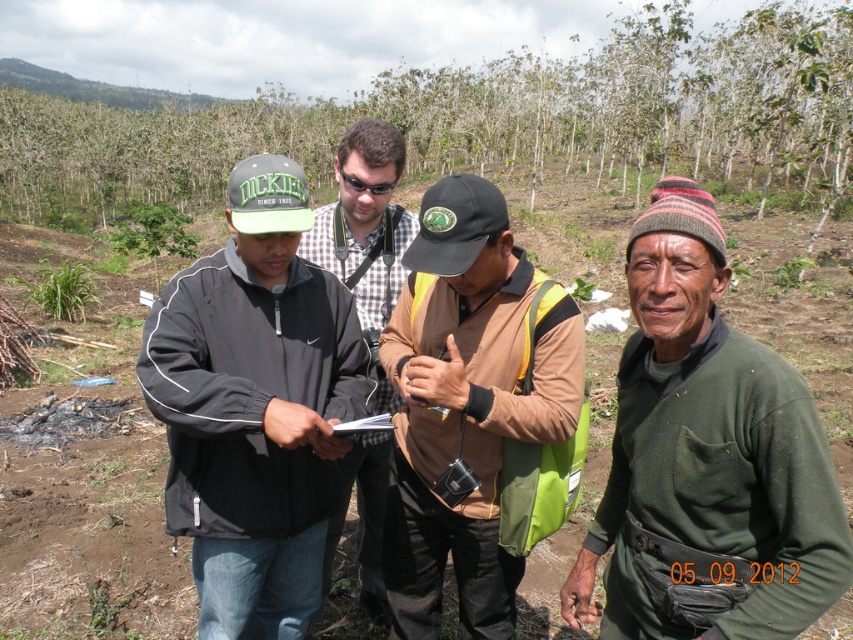
Is black matte jacket at center further to the viewer compared to checkered fabric shirt at center?

No, it is in front of checkered fabric shirt at center.

Measure the distance between point [260,580] and camera.

They are 7.46 feet apart.

The width and height of the screenshot is (853, 640). What are the coordinates of `black matte jacket at center` in the screenshot? It's located at (256, 408).

Based on the photo, is black matte jacket at center positioned behind brown fabric shirt at center?

That is False.

How much distance is there between black matte jacket at center and brown fabric shirt at center?

A distance of 41.23 centimeters exists between black matte jacket at center and brown fabric shirt at center.

Which is behind, point (248, 449) or point (457, 275)?

Point (248, 449)

At what (x,y) coordinates should I click in order to perform the action: click on black matte jacket at center. Please return your answer as a coordinate pair (x, y). The height and width of the screenshot is (640, 853). Looking at the image, I should click on (256, 408).

Can you confirm if checkered fabric shirt at center is positioned above black plastic goggles at center?

→ Incorrect, checkered fabric shirt at center is not positioned above black plastic goggles at center.

Does point (381, 589) lie in front of point (358, 182)?

That is False.

Image resolution: width=853 pixels, height=640 pixels. What are the coordinates of `checkered fabric shirt at center` in the screenshot? It's located at (364, 236).